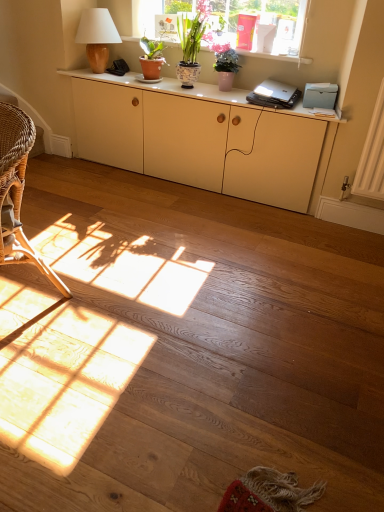
Where is `free area below woven rattan chair at left (from a real-world perspective)`? free area below woven rattan chair at left (from a real-world perspective) is located at coordinates (28, 311).